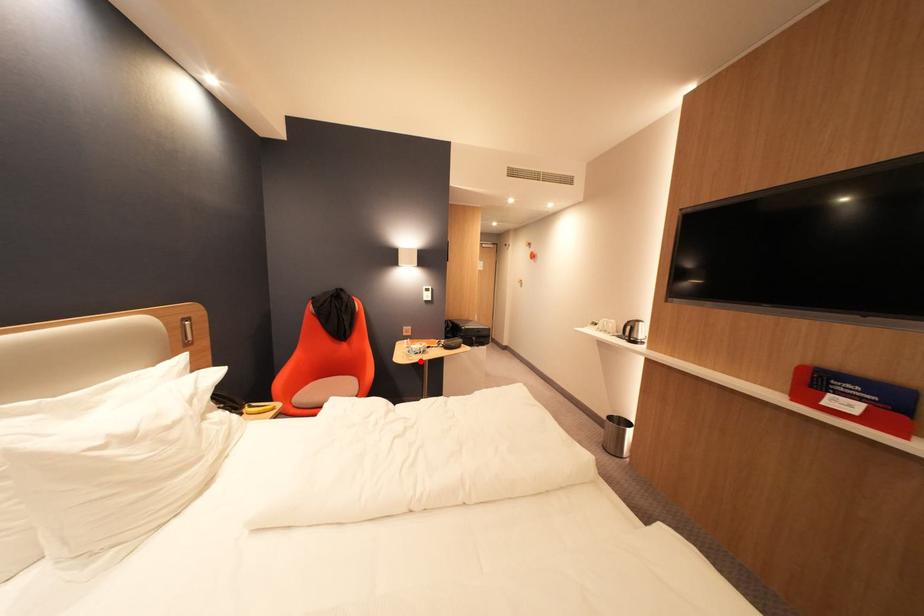
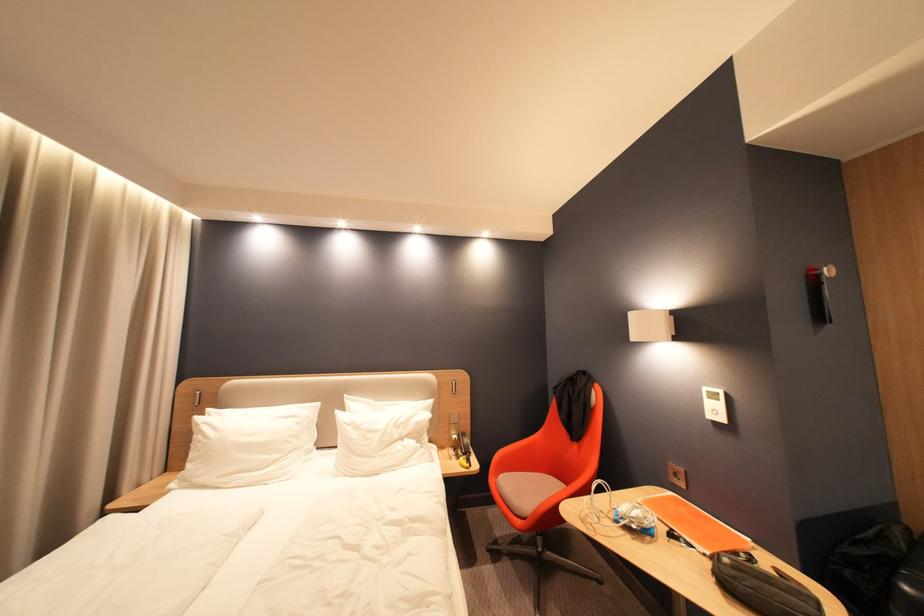
Find the pixel in the second image that matches the highlighted location in the first image.

(592, 523)